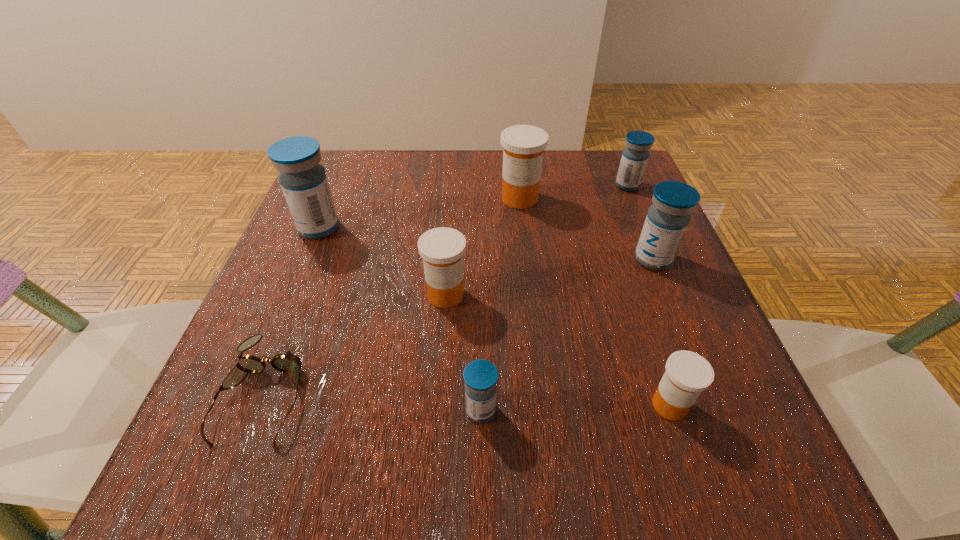
The image size is (960, 540). I want to click on the second closest object relative to the tallest object, so click(x=288, y=363).

Locate which object is the sixth closest to the sixth medicine from right to left. Please provide its 2D coordinates. Your answer should be formatted as a tuple, i.e. [(x, y)], where the tuple contains the x and y coordinates of a point satisfying the conditions above.

[(668, 217)]

Identify which medicine is located as the fourth nearest to the second smallest blue medicine. Please provide its 2D coordinates. Your answer should be formatted as a tuple, i.e. [(x, y)], where the tuple contains the x and y coordinates of a point satisfying the conditions above.

[(687, 374)]

Select which medicine is the third closest to the third smallest blue medicine. Please provide its 2D coordinates. Your answer should be formatted as a tuple, i.e. [(x, y)], where the tuple contains the x and y coordinates of a point satisfying the conditions above.

[(687, 374)]

Identify which blue medicine is the second nearest to the fifth farthest medicine. Please provide its 2D coordinates. Your answer should be formatted as a tuple, i.e. [(x, y)], where the tuple contains the x and y coordinates of a point satisfying the conditions above.

[(303, 180)]

Image resolution: width=960 pixels, height=540 pixels. I want to click on blue medicine that is the second closest one to the tallest medicine, so click(668, 217).

Select which orange medicine is the third closest to the fourth farthest medicine. Please provide its 2D coordinates. Your answer should be formatted as a tuple, i.e. [(x, y)], where the tuple contains the x and y coordinates of a point satisfying the conditions above.

[(442, 249)]

Find the location of a particular element. This screenshot has height=540, width=960. orange medicine that stands as the closest to the smallest blue medicine is located at coordinates (442, 249).

The height and width of the screenshot is (540, 960). In order to click on free space that satisfies the following two spatial constraints: 1. on the label of the third farthest blue medicine; 2. on the right side of the fourth medicine from left to right in this screenshot , I will do `click(526, 259)`.